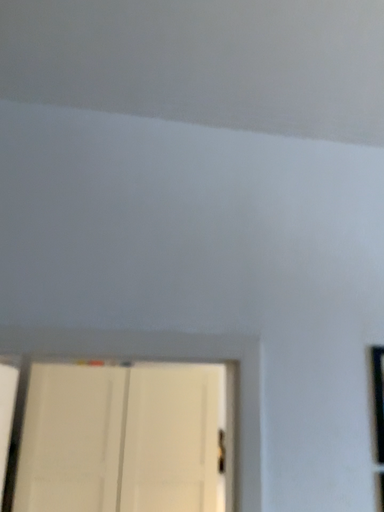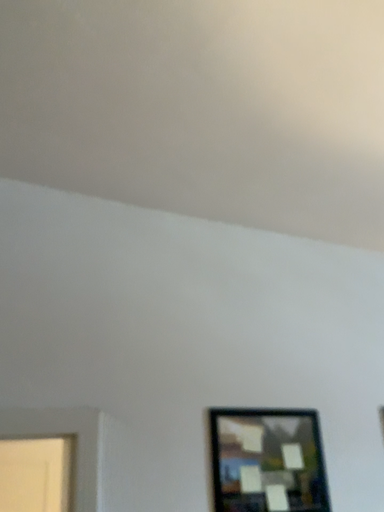
Question: How did the camera likely rotate when shooting the video?

Choices:
 (A) rotated downward
 (B) rotated upward

Answer: (B)